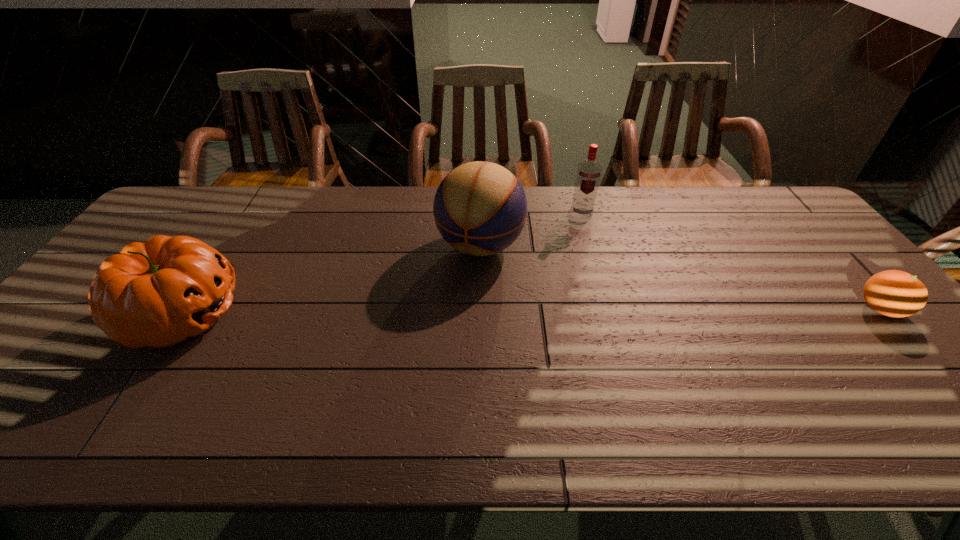
At what (x,y) coordinates should I click in order to perform the action: click on vacant region at the near edge. Please return your answer as a coordinate pair (x, y). This screenshot has height=540, width=960. Looking at the image, I should click on (549, 375).

Identify the location of vacant space at the far left corner of the desktop. (180, 204).

Identify the location of blank region between the basketball and the shortest object. (681, 278).

Locate an element on the screen. The image size is (960, 540). empty space between the farthest object and the leftmost object is located at coordinates (382, 264).

I want to click on unoccupied position between the pumpkin and the third object from right to left, so click(x=331, y=280).

Find the location of a particular element. blank region between the pumpkin and the orange is located at coordinates (531, 312).

You are a GUI agent. You are given a task and a screenshot of the screen. Output one action in this format:
    pyautogui.click(x=<x>, y=<y>)
    Task: Click on the free space between the leftmost object and the farthest object
    
    Given the screenshot: What is the action you would take?
    click(x=382, y=264)

You are a GUI agent. You are given a task and a screenshot of the screen. Output one action in this format:
    pyautogui.click(x=<x>, y=<y>)
    Task: Click on the free space between the vodka and the second shortest object
    Image resolution: width=960 pixels, height=540 pixels.
    Given the screenshot: What is the action you would take?
    pyautogui.click(x=382, y=264)

At what (x,y) coordinates should I click in order to perform the action: click on free space between the rightmost object and the second shortest object. Please return your answer as a coordinate pair (x, y). Image resolution: width=960 pixels, height=540 pixels. Looking at the image, I should click on (531, 312).

At what (x,y) coordinates should I click in order to perform the action: click on blank region between the orange and the leftmost object. Please return your answer as a coordinate pair (x, y). Looking at the image, I should click on [531, 312].